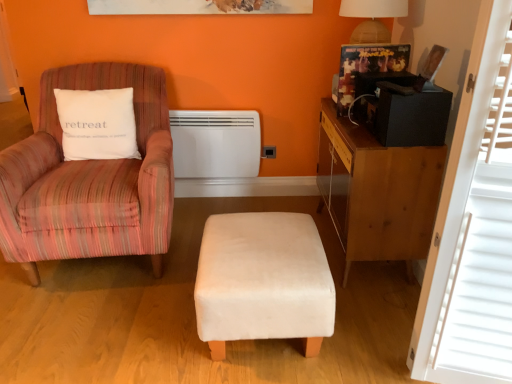
Question: Does point (464, 211) appear closer or farther from the camera than point (234, 221)?

Choices:
 (A) farther
 (B) closer

Answer: (B)

Question: Would you say white wood window screen at right is to the left or to the right of velvet white stool at center in the picture?

Choices:
 (A) left
 (B) right

Answer: (B)

Question: Estimate the real-world distances between objects in this image. Which object is farther from the white wood window screen at right?

Choices:
 (A) white matte heater at center
 (B) white velvety pillow at left
 (C) pink striped fabric chair at left
 (D) wooden desk at right
 (E) velvet white stool at center

Answer: (B)

Question: Which object is the farthest from the white velvety pillow at left?

Choices:
 (A) white matte heater at center
 (B) wooden desk at right
 (C) white wood window screen at right
 (D) pink striped fabric chair at left
 (E) velvet white stool at center

Answer: (C)